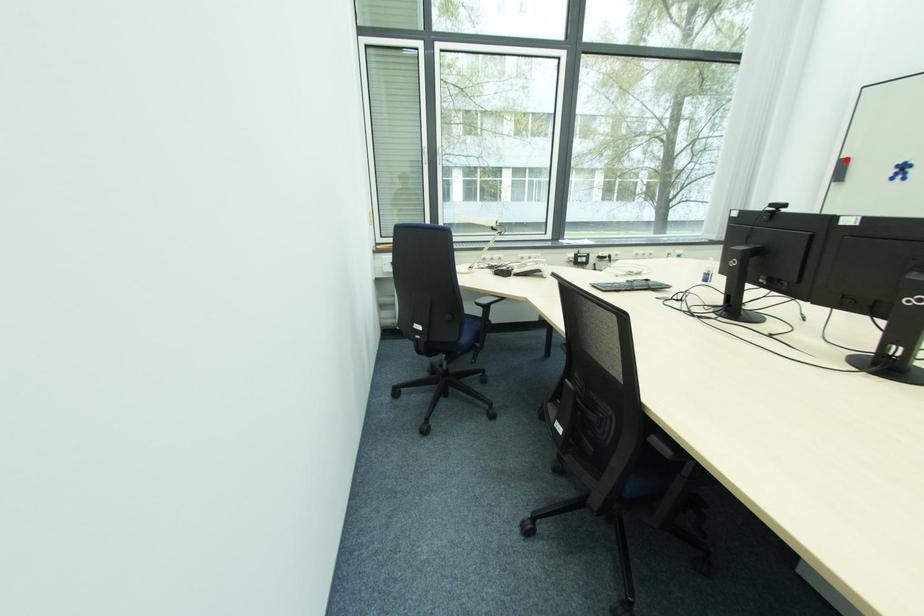
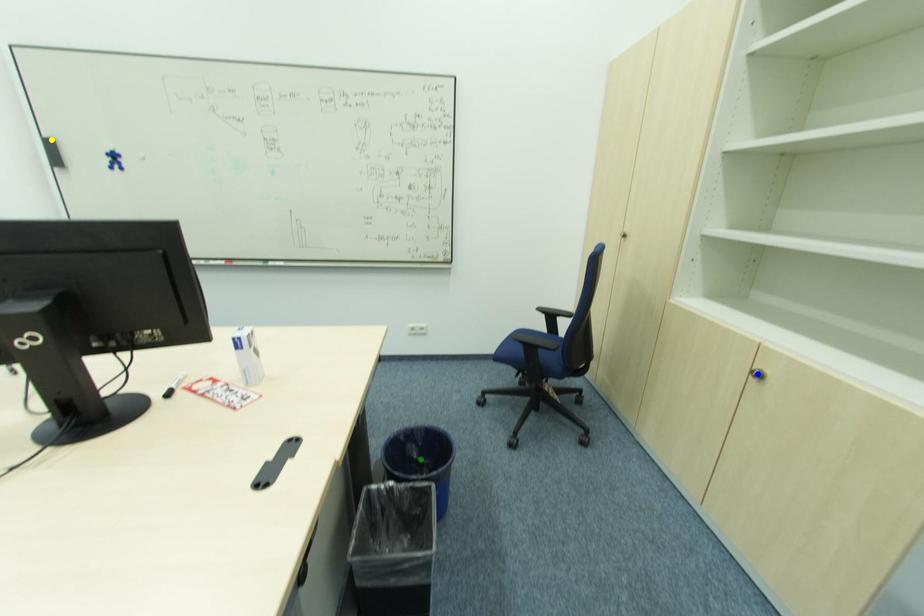
Question: I am providing you with two images of the same scene from different viewpoints. A red point is marked on the first image. You are given multiple points on the second image. Which point in image 2 is actually the same real-world point as the red point in image 1?

Choices:
 (A) blue point
 (B) yellow point
 (C) green point

Answer: (B)